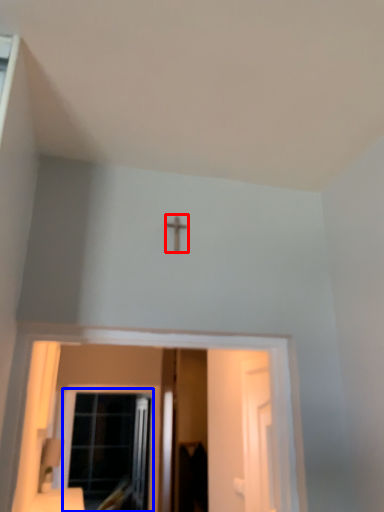
Question: Which of the following is the farthest to the observer, crucifix (highlighted by a red box) or window (highlighted by a blue box)?

Choices:
 (A) crucifix
 (B) window

Answer: (B)